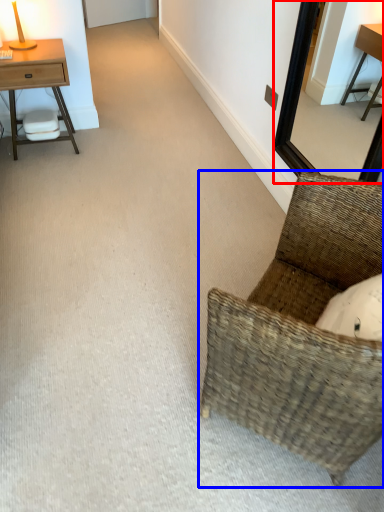
Question: Which object is closer to the camera taking this photo, mirror (highlighted by a red box) or chair (highlighted by a blue box)?

Choices:
 (A) mirror
 (B) chair

Answer: (B)